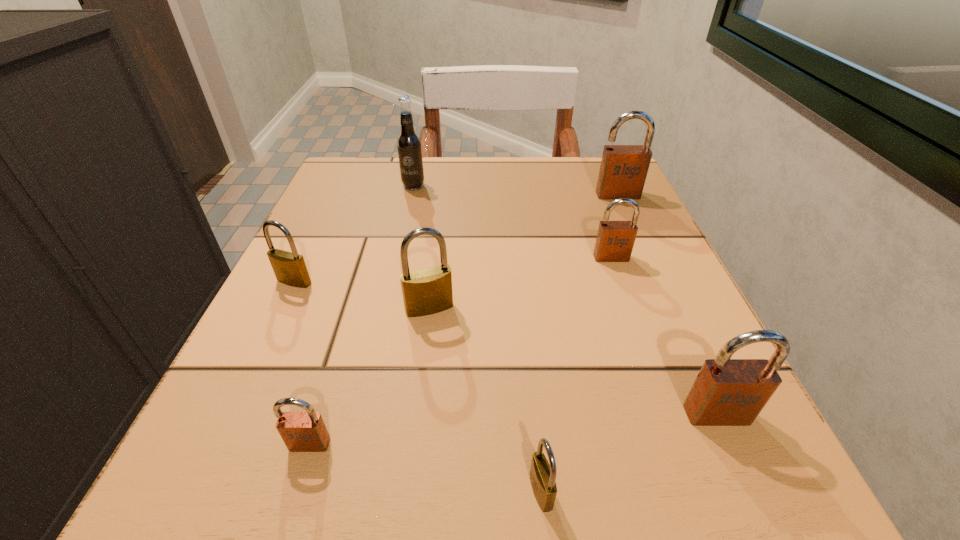
Locate an element on the screen. Image resolution: width=960 pixels, height=540 pixels. vacant space located on the back of the nearest brass padlock is located at coordinates (528, 369).

Find the location of `vacant space located 0.050m on the front-facing side of the second padlock from left to right`. vacant space located 0.050m on the front-facing side of the second padlock from left to right is located at coordinates (294, 497).

Find the location of a particular element. The width and height of the screenshot is (960, 540). root beer that is at the far edge is located at coordinates (x=409, y=145).

At what (x,y) coordinates should I click in order to perform the action: click on padlock that is at the far edge. Please return your answer as a coordinate pair (x, y). Looking at the image, I should click on (623, 170).

Locate an element on the screen. root beer situated at the left edge is located at coordinates (409, 145).

Find the location of `object positioned at the far left corner`. object positioned at the far left corner is located at coordinates (409, 145).

Identify the location of object present at the near left corner. The image size is (960, 540). (300, 431).

Where is `object at the far right corner`? This screenshot has width=960, height=540. object at the far right corner is located at coordinates (623, 170).

I want to click on free space at the far edge of the desktop, so click(x=492, y=206).

At what (x,y) coordinates should I click in order to perform the action: click on vacant area at the near edge. Please return your answer as a coordinate pair (x, y). This screenshot has height=540, width=960. Looking at the image, I should click on (514, 447).